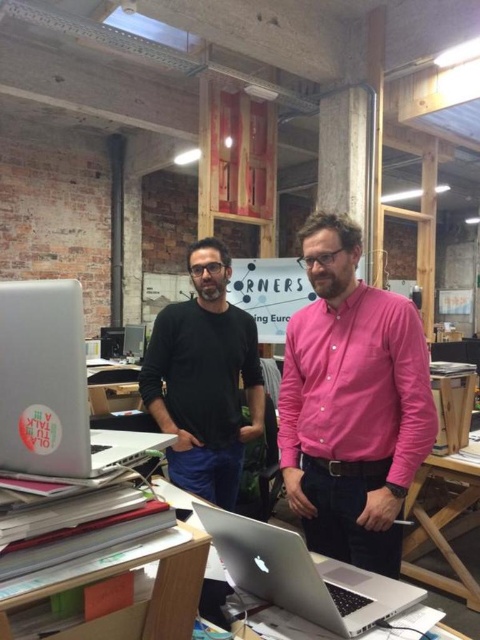
Is pink cotton shirt at center shorter than silver metallic laptop at center?

In fact, pink cotton shirt at center may be taller than silver metallic laptop at center.

Is pink cotton shirt at center wider than silver metallic laptop at center?

In fact, pink cotton shirt at center might be narrower than silver metallic laptop at center.

Who is more distant from viewer, (360, 448) or (230, 570)?

The point (360, 448) is more distant.

Locate an element on the screen. pink cotton shirt at center is located at coordinates click(351, 403).

Does pink cotton shirt at center have a larger size compared to black matte shirt at center?

No.

Is pink cotton shirt at center wider than black matte shirt at center?

No.

The height and width of the screenshot is (640, 480). In order to click on pink cotton shirt at center in this screenshot , I will do `click(351, 403)`.

What do you see at coordinates (204, 380) in the screenshot? I see `black matte shirt at center` at bounding box center [204, 380].

Can you confirm if black matte shirt at center is wider than wooden table at center?

No.

What do you see at coordinates (204, 380) in the screenshot? This screenshot has width=480, height=640. I see `black matte shirt at center` at bounding box center [204, 380].

Identify the location of black matte shirt at center. This screenshot has width=480, height=640. (204, 380).